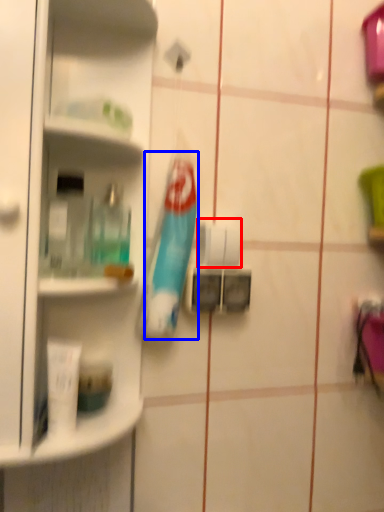
Question: Which point is further to the camera, toilet paper (highlighted by a red box) or toothbrush (highlighted by a blue box)?

Choices:
 (A) toilet paper
 (B) toothbrush

Answer: (A)